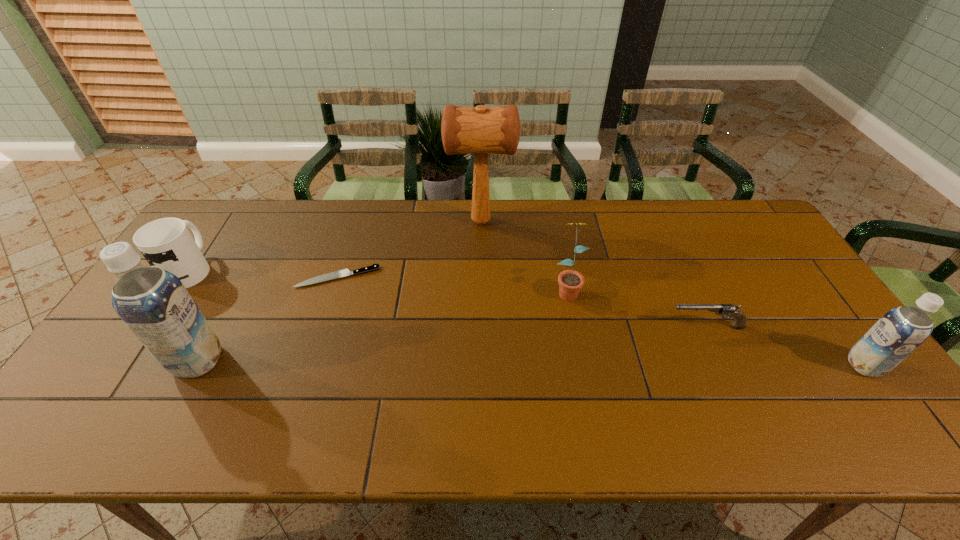
If equal spacing is the goal by inserting an additional soya_milk among them, please point out a vacant space for this new soya_milk. Please provide its 2D coordinates. Your answer should be formatted as a tuple, i.e. [(x, y)], where the tuple contains the x and y coordinates of a point satisfying the conditions above.

[(530, 363)]